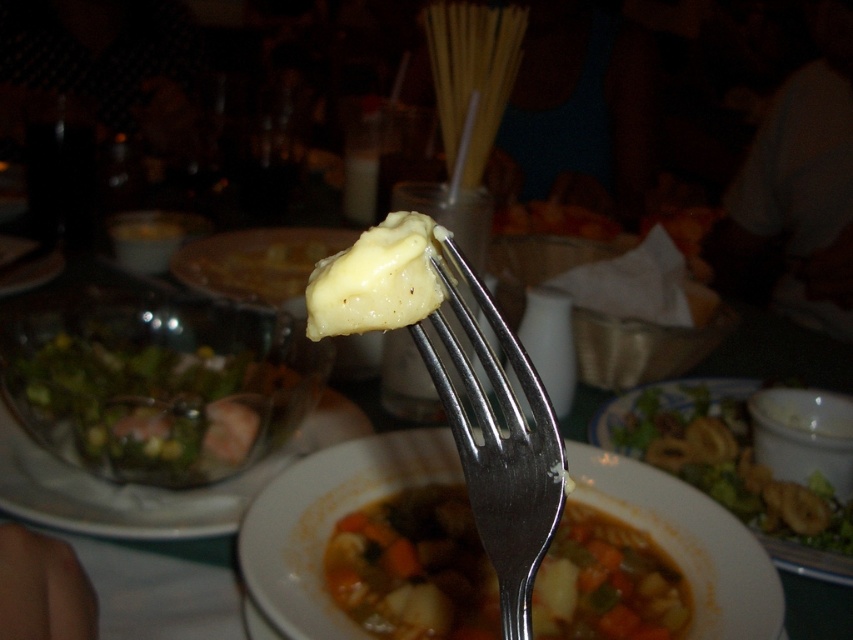
You are a food critic sitting at the table. You need to describe the spatial relationship between the silver metallic fork at center and the green leafy salad at center. Which one is closer to you?

The silver metallic fork at center is closer to the viewer than the green leafy salad at center.

You are a food critic evaluating the presentation of this dish. The fork holds the yellow creamy cheese at fork center, while the bowl has the yellow creamy substance at center. Which portion is larger?

The yellow creamy substance at center is bigger than the yellow creamy cheese at fork center, so the portion in the bowl is larger.

You are a food critic observing the dining setting and notice the fork holding the yellow creamy cheese at fork center and yellow creamy cheese at fork tip. Which piece of cheese is closer to the bowl of vegetable stew?

The yellow creamy cheese at fork center is positioned under the yellow creamy cheese at fork tip, so the cheese at fork center is closer to the bowl of vegetable stew.